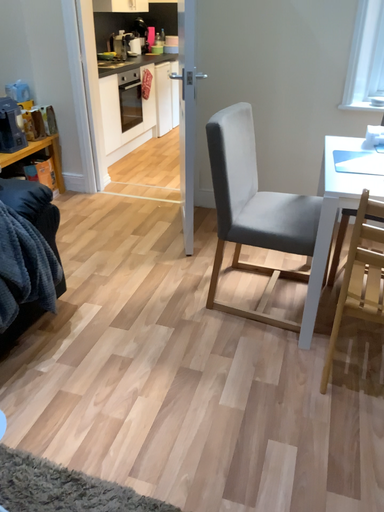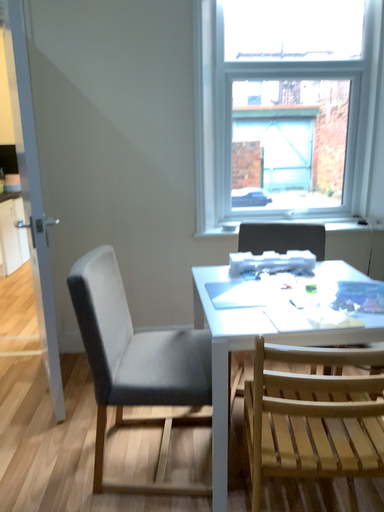
Question: How did the camera likely rotate when shooting the video?

Choices:
 (A) rotated downward
 (B) rotated upward

Answer: (B)